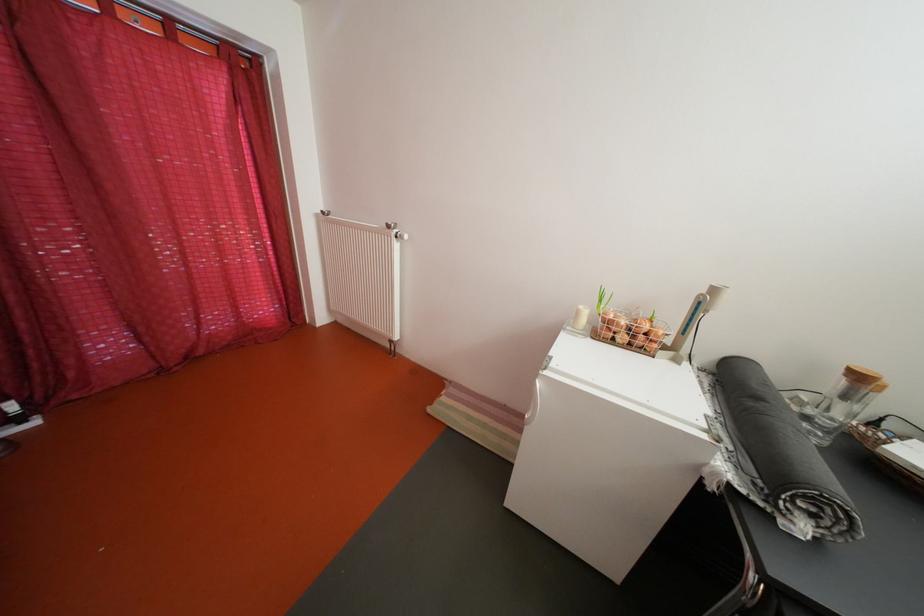
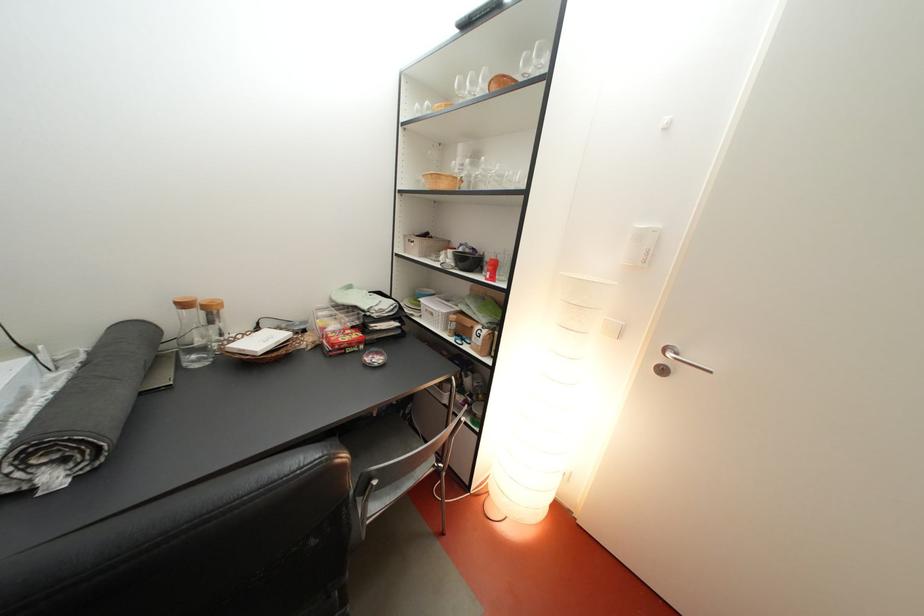
The first image is from the beginning of the video and the second image is from the end. How did the camera likely rotate when shooting the video?

The rotation direction of the camera is right-down.